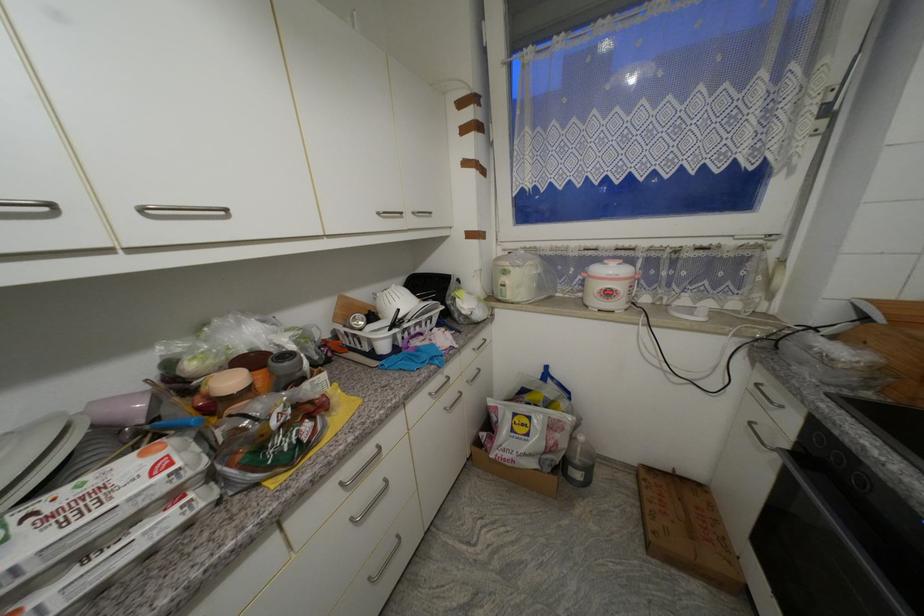
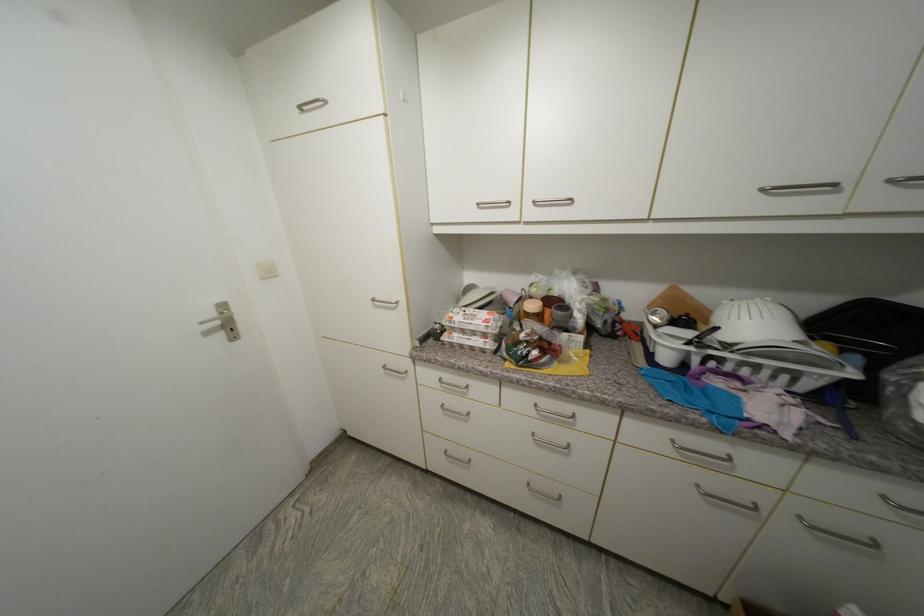
The point at [435,395] is marked in the first image. Where is the corresponding point in the second image?

(678, 443)